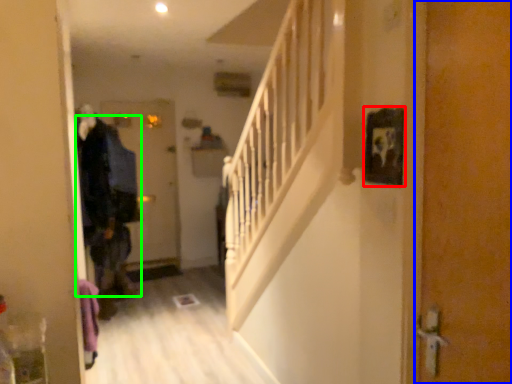
Question: Estimate the real-world distances between objects in this image. Which object is closer to picture frame (highlighted by a red box), door (highlighted by a blue box) or clothing (highlighted by a green box)?

Choices:
 (A) door
 (B) clothing

Answer: (A)